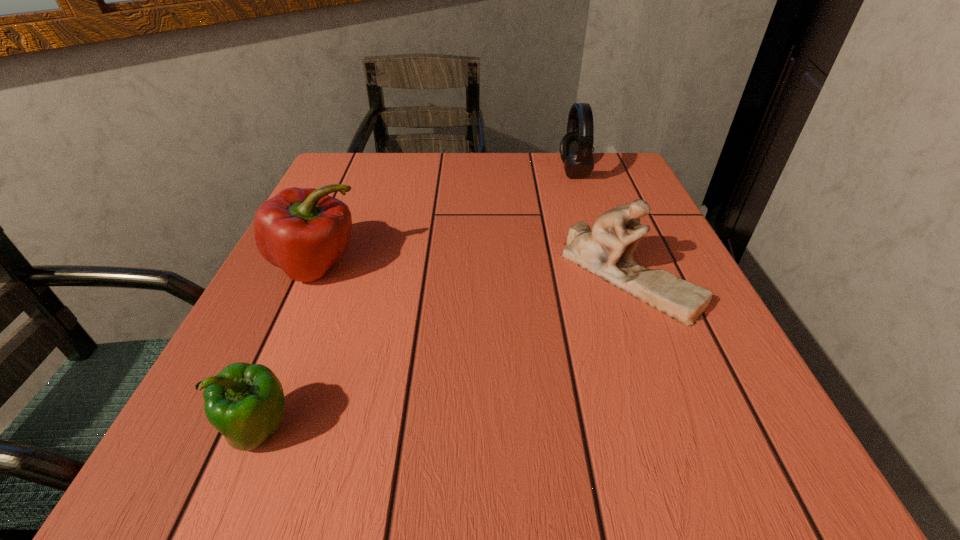
Where is `vacant space located 0.130m on the right of the nearer bell pepper`? The image size is (960, 540). vacant space located 0.130m on the right of the nearer bell pepper is located at coordinates (396, 431).

The height and width of the screenshot is (540, 960). In order to click on object positioned at the far edge in this screenshot , I will do `click(576, 146)`.

Where is `object at the near edge`? object at the near edge is located at coordinates (245, 403).

At what (x,y) coordinates should I click in order to perform the action: click on headset that is at the right edge. Please return your answer as a coordinate pair (x, y). The height and width of the screenshot is (540, 960). Looking at the image, I should click on (576, 146).

The image size is (960, 540). I want to click on figurine present at the right edge, so click(606, 251).

Where is `object positioned at the near left corner`? The height and width of the screenshot is (540, 960). object positioned at the near left corner is located at coordinates (245, 403).

Identify the location of object located at the far right corner. Image resolution: width=960 pixels, height=540 pixels. (576, 146).

Find the location of `free space at the far edge of the desktop`. free space at the far edge of the desktop is located at coordinates (429, 165).

This screenshot has height=540, width=960. In the image, there is a desktop. Find the location of `free space at the near edge`. free space at the near edge is located at coordinates (430, 433).

Identify the location of vacant region at the left edge of the desktop. [245, 338].